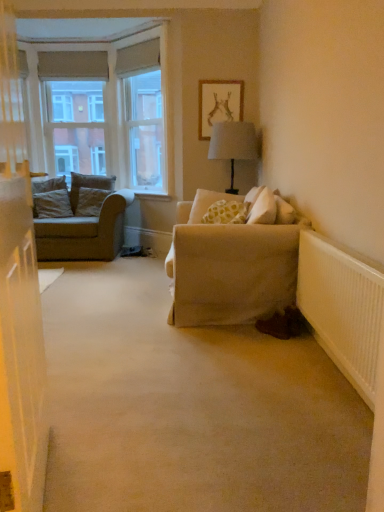
Question: Based on their positions, is textured gray pillow at left, the 3th pillow when ordered from right to left, located to the left or right of white painted wood at center?

Choices:
 (A) right
 (B) left

Answer: (B)

Question: Is point (84, 182) positioned closer to the camera than point (139, 198)?

Choices:
 (A) farther
 (B) closer

Answer: (A)

Question: Based on their relative distances, which object is nearer to the textured gray pillow at left, marked as the first pillow in a back-to-front arrangement?

Choices:
 (A) white painted wood at upper left
 (B) textured gray pillow at left, which is counted as the 2th pillow, starting from the back
 (C) light gray fabric pillow at left, placed as the first pillow when sorted from left to right
 (D) yellow dotted fabric pillow at center, positioned as the first pillow in right-to-left order
 (E) beige fabric couch at left

Answer: (B)

Question: Considering the real-world distances, which object is farthest from the light gray fabric pillow at left, arranged as the third pillow when viewed from the back?

Choices:
 (A) matte wooden picture frame at upper center
 (B) white painted wood at upper left
 (C) white painted wood at center
 (D) textured gray pillow at left, the second pillow viewed from the right
 (E) white ribbed radiator at lower right

Answer: (E)